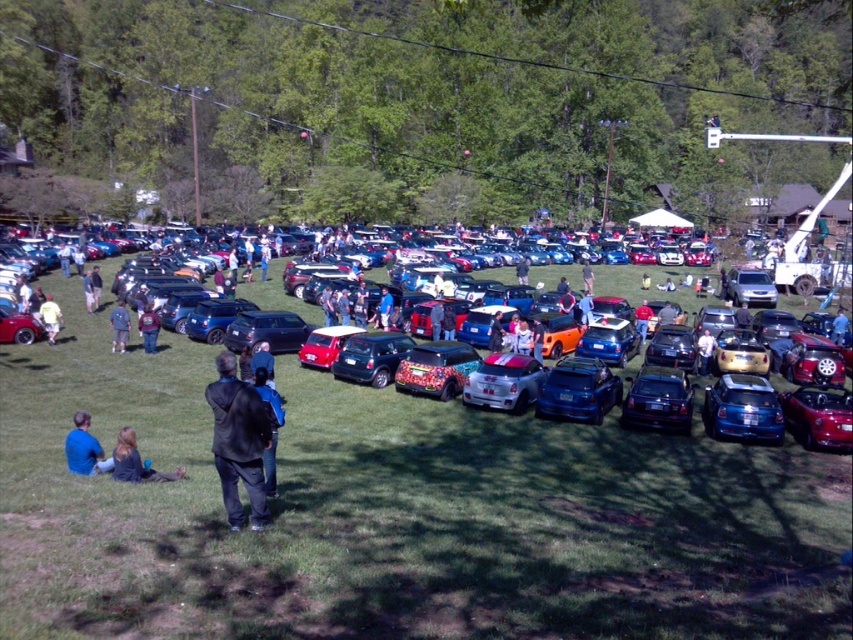
Can you confirm if shiny metallic car at center is smaller than floral-patterned matte car at center?

Incorrect, shiny metallic car at center is not smaller in size than floral-patterned matte car at center.

Does shiny metallic car at center appear on the right side of floral-patterned matte car at center?

Yes, shiny metallic car at center is to the right of floral-patterned matte car at center.

Does point (102, 364) come behind point (451, 376)?

Yes.

Image resolution: width=853 pixels, height=640 pixels. What are the coordinates of `shiny metallic car at center` in the screenshot? It's located at (497, 444).

Does floral-patterned matte car at center appear over blue fabric shirt at lower left?

Yes.

I want to click on floral-patterned matte car at center, so click(436, 369).

Is point (444, 396) positioned after point (93, 464)?

Yes.

At what (x,y) coordinates should I click in order to perform the action: click on floral-patterned matte car at center. Please return your answer as a coordinate pair (x, y). Image resolution: width=853 pixels, height=640 pixels. Looking at the image, I should click on (436, 369).

Between floral-patterned matte car at center and matte black car at center, which one appears on the left side from the viewer's perspective?

floral-patterned matte car at center is more to the left.

Is floral-patterned matte car at center smaller than matte black car at center?

No.

Does point (426, 371) come farther from viewer compared to point (709, 364)?

No, (426, 371) is in front of (709, 364).

In order to click on floral-patterned matte car at center in this screenshot , I will do `click(436, 369)`.